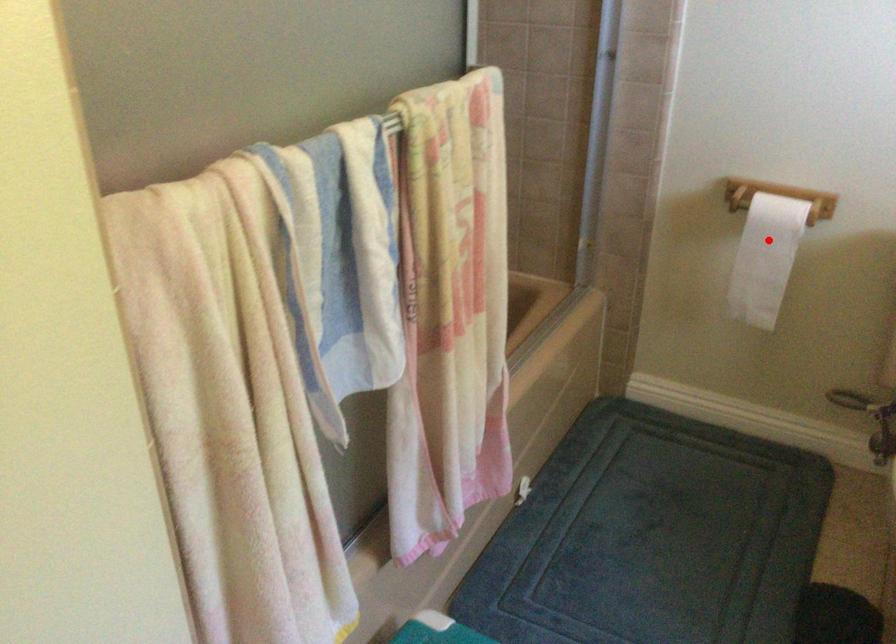
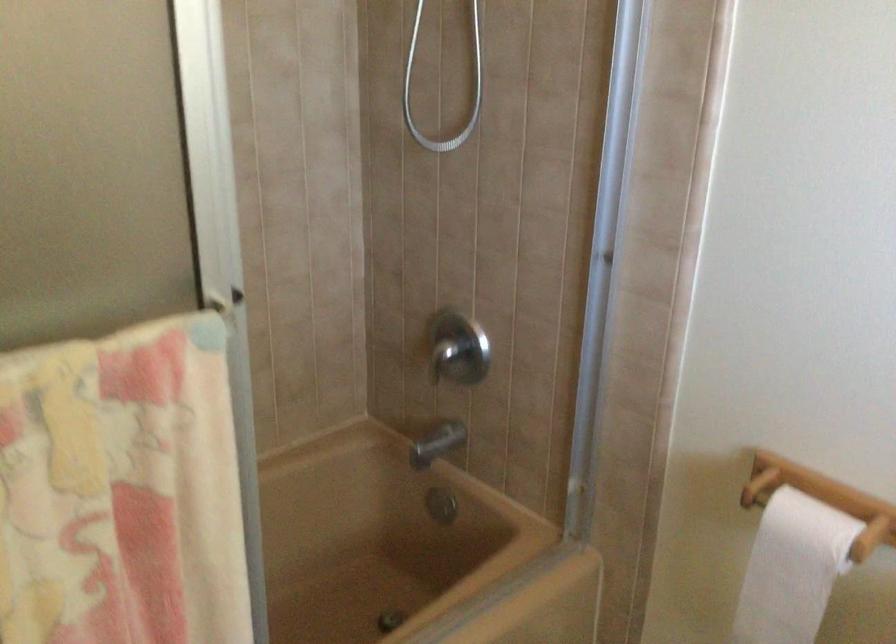
Find the pixel in the second image that matches the highlighted location in the first image.

(791, 569)